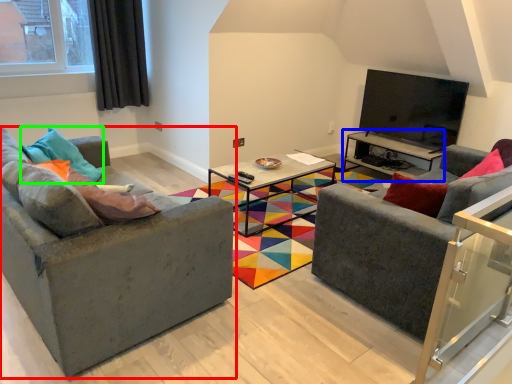
Question: Based on their relative distances, which object is farther from studio couch (highlighted by a red box)? Choose from table (highlighted by a blue box) and pillow (highlighted by a green box).

Choices:
 (A) table
 (B) pillow

Answer: (A)